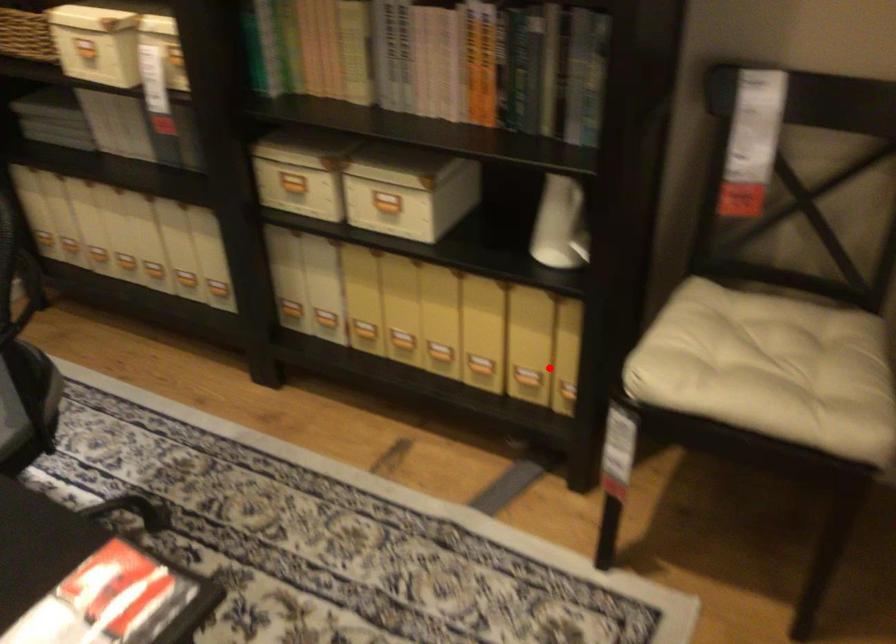
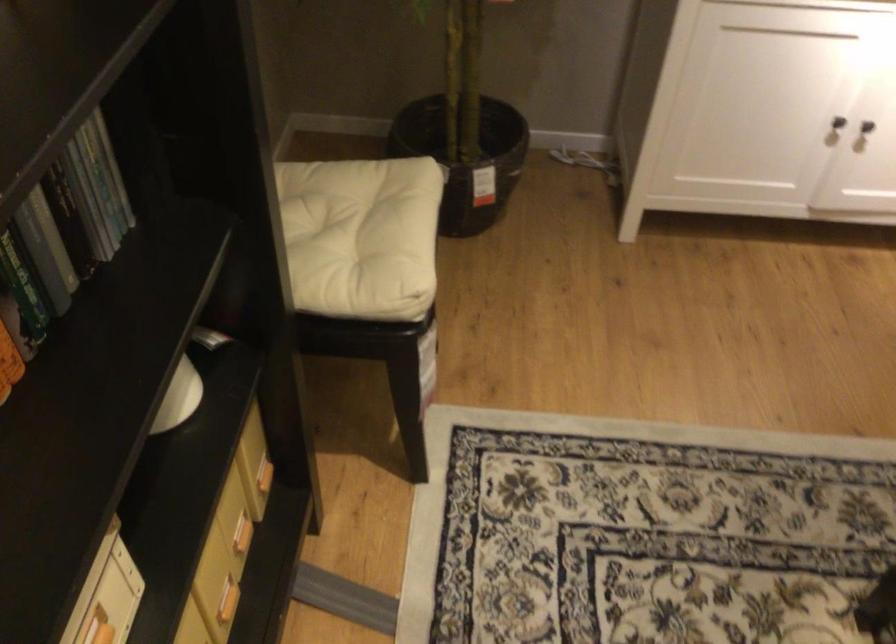
The point at the highlighted location is marked in the first image. Where is the corresponding point in the second image?

(240, 534)